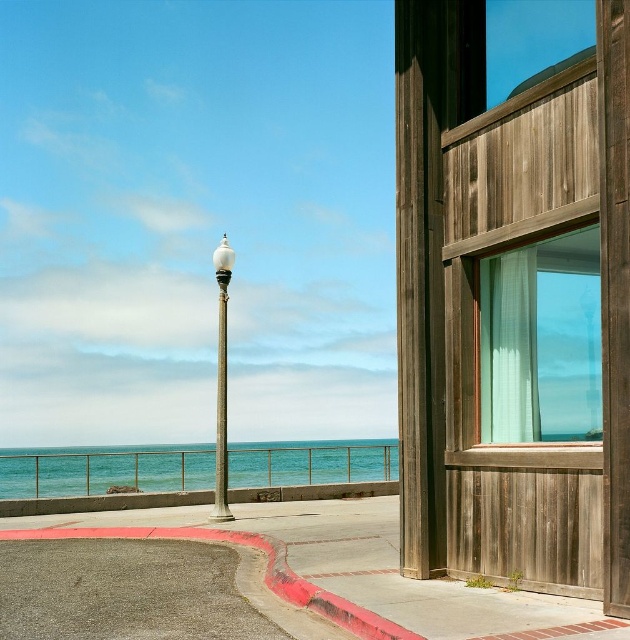
How far apart are translucent teal curtain at right and blue water at lower left?

A distance of 15.16 meters exists between translucent teal curtain at right and blue water at lower left.

Which is in front, point (563, 364) or point (333, 458)?

Point (563, 364)

Which is in front, point (573, 246) or point (161, 467)?

Point (573, 246) is more forward.

At what (x,y) coordinates should I click in order to perform the action: click on translucent teal curtain at right. Please return your answer as a coordinate pair (x, y). Looking at the image, I should click on (541, 340).

Which is below, translucent teal curtain at right or white glossy lamp post at center?

white glossy lamp post at center is lower down.

Is translucent teal curtain at right wider than white glossy lamp post at center?

No, translucent teal curtain at right is not wider than white glossy lamp post at center.

Identify the location of translucent teal curtain at right. The image size is (630, 640). (541, 340).

Which is more to the right, blue water at lower left or red painted concrete curb at lower left?

red painted concrete curb at lower left is more to the right.

Can you confirm if blue water at lower left is positioned to the right of red painted concrete curb at lower left?

No, blue water at lower left is not to the right of red painted concrete curb at lower left.

The width and height of the screenshot is (630, 640). I want to click on blue water at lower left, so click(105, 472).